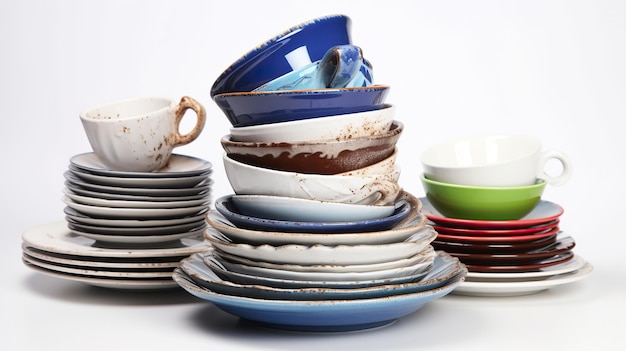
Locate an element on the screen. This screenshot has width=626, height=351. red plates is located at coordinates (552, 210), (523, 226), (518, 236), (499, 245), (519, 257), (511, 265).